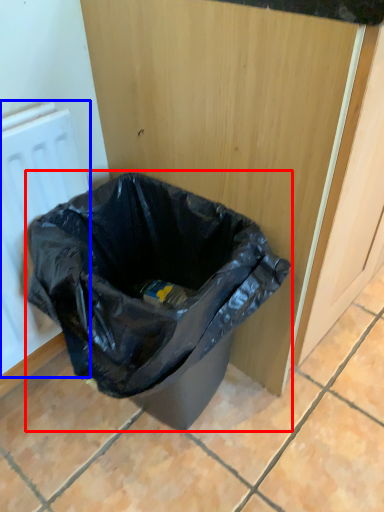
Question: Which point is closer to the camera, waste container (highlighted by a red box) or radiator (highlighted by a blue box)?

Choices:
 (A) waste container
 (B) radiator

Answer: (A)